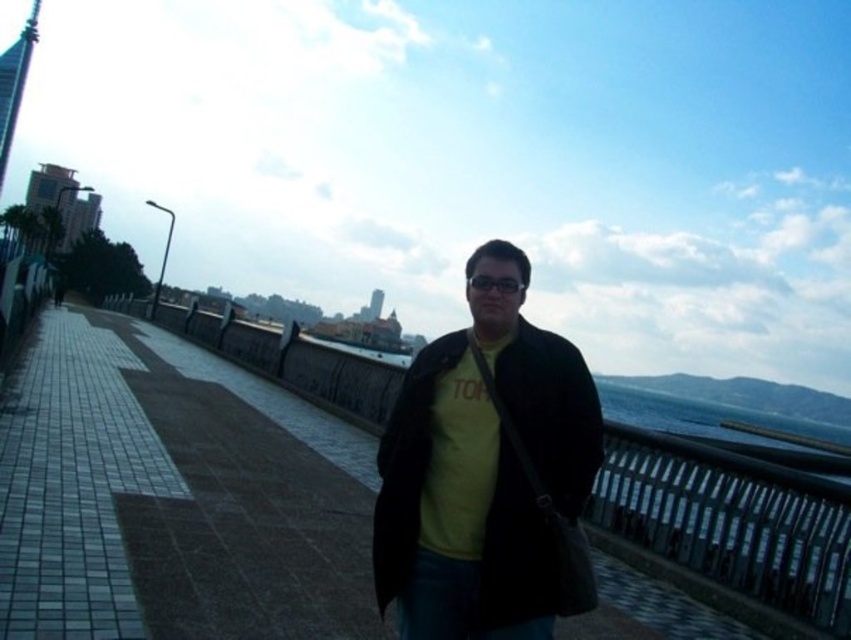
You are a photographer positioned on the walkway. You want to capture a photo of the yellow matte shirt at center without the black metal rail at center appearing in the background. Is this possible based on their positions?

The yellow matte shirt at center is in front of the black metal rail at center, so if you position yourself so that the shirt blocks the rail, it should be possible to take a photo of the shirt without the rail visible in the background.

You are a photographer trying to capture a clear shot of the cityscape behind the person. Since the yellow matte shirt at center and the black metal rail at center are both in the frame, which object should you adjust your camera to focus on to ensure the cityscape is visible without obstruction?

The yellow matte shirt at center is positioned over the black metal rail at center, so focusing on the black metal rail at center would allow the cityscape behind to be visible without obstruction from the shirt.